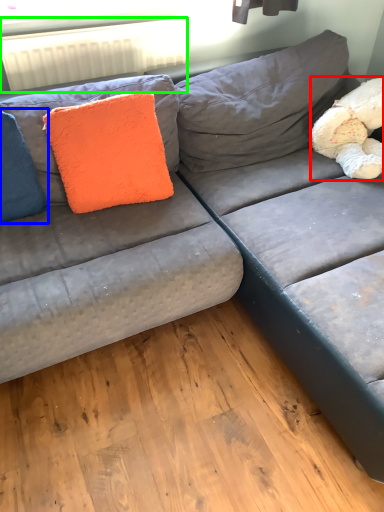
Question: Which object is positioned farthest from teddy (highlighted by a red box)? Select from pillow (highlighted by a blue box) and radiator (highlighted by a green box).

Choices:
 (A) pillow
 (B) radiator

Answer: (A)